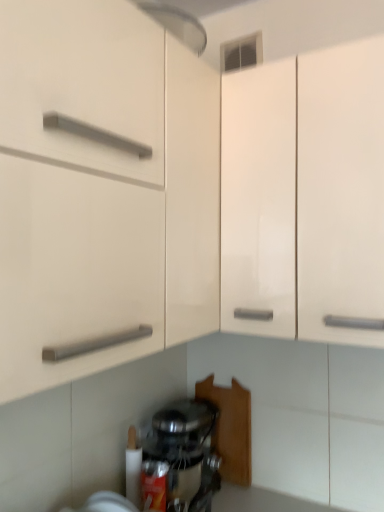
Question: Considering the relative sizes of satin silver mixer at lower center and white glossy cabinet at center in the image provided, is satin silver mixer at lower center bigger than white glossy cabinet at center?

Choices:
 (A) no
 (B) yes

Answer: (A)

Question: Does satin silver mixer at lower center appear on the right side of white glossy cabinet at center?

Choices:
 (A) yes
 (B) no

Answer: (B)

Question: From the image's perspective, is satin silver mixer at lower center beneath white glossy cabinet at center?

Choices:
 (A) yes
 (B) no

Answer: (A)

Question: Is satin silver mixer at lower center oriented towards white glossy cabinet at center?

Choices:
 (A) yes
 (B) no

Answer: (B)

Question: Could white glossy cabinet at center be considered to be inside satin silver mixer at lower center?

Choices:
 (A) no
 (B) yes

Answer: (A)

Question: Does satin silver mixer at lower center have a greater height compared to white glossy cabinet at center?

Choices:
 (A) yes
 (B) no

Answer: (B)

Question: Does white glossy cabinet at center have a lesser width compared to satin silver mixer at lower center?

Choices:
 (A) no
 (B) yes

Answer: (B)

Question: Is white glossy cabinet at center touching satin silver mixer at lower center?

Choices:
 (A) no
 (B) yes

Answer: (A)

Question: Considering the relative sizes of white glossy cabinet at center and satin silver mixer at lower center in the image provided, is white glossy cabinet at center shorter than satin silver mixer at lower center?

Choices:
 (A) no
 (B) yes

Answer: (A)

Question: From a real-world perspective, is white glossy cabinet at center physically above satin silver mixer at lower center?

Choices:
 (A) no
 (B) yes

Answer: (B)

Question: Is white glossy cabinet at center not inside satin silver mixer at lower center?

Choices:
 (A) no
 (B) yes

Answer: (B)

Question: Considering the relative sizes of white glossy cabinet at center and satin silver mixer at lower center in the image provided, is white glossy cabinet at center bigger than satin silver mixer at lower center?

Choices:
 (A) yes
 (B) no

Answer: (A)

Question: From a real-world perspective, is white glossy cabinet at center positioned above or below satin silver mixer at lower center?

Choices:
 (A) above
 (B) below

Answer: (A)